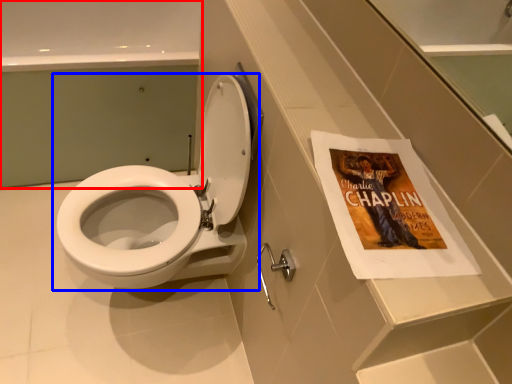
Question: Which object is further to the camera taking this photo, bath (highlighted by a red box) or toilet (highlighted by a blue box)?

Choices:
 (A) bath
 (B) toilet

Answer: (A)